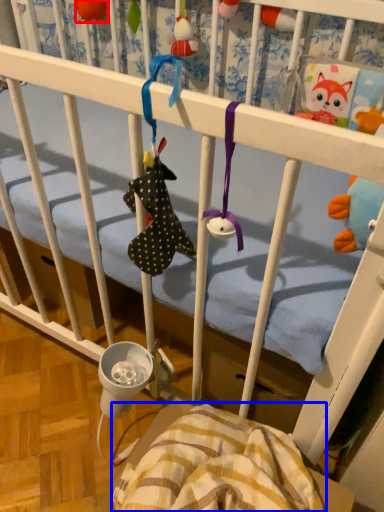
Question: Among these objects, which one is nearest to the camera, toy (highlighted by a red box) or blanket (highlighted by a blue box)?

Choices:
 (A) toy
 (B) blanket

Answer: (B)